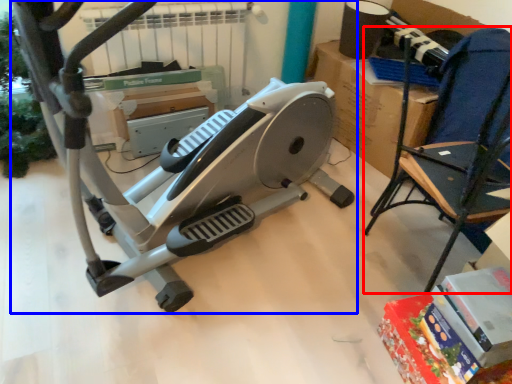
Question: Which of the following is the farthest to the observer, chair (highlighted by a red box) or stationary bicycle (highlighted by a blue box)?

Choices:
 (A) chair
 (B) stationary bicycle

Answer: (A)